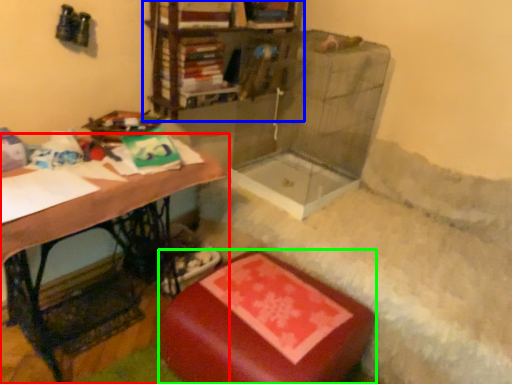
Question: Which is nearer to the table (highlighted by a red box)? shelf (highlighted by a blue box) or furniture (highlighted by a green box).

Choices:
 (A) shelf
 (B) furniture

Answer: (B)